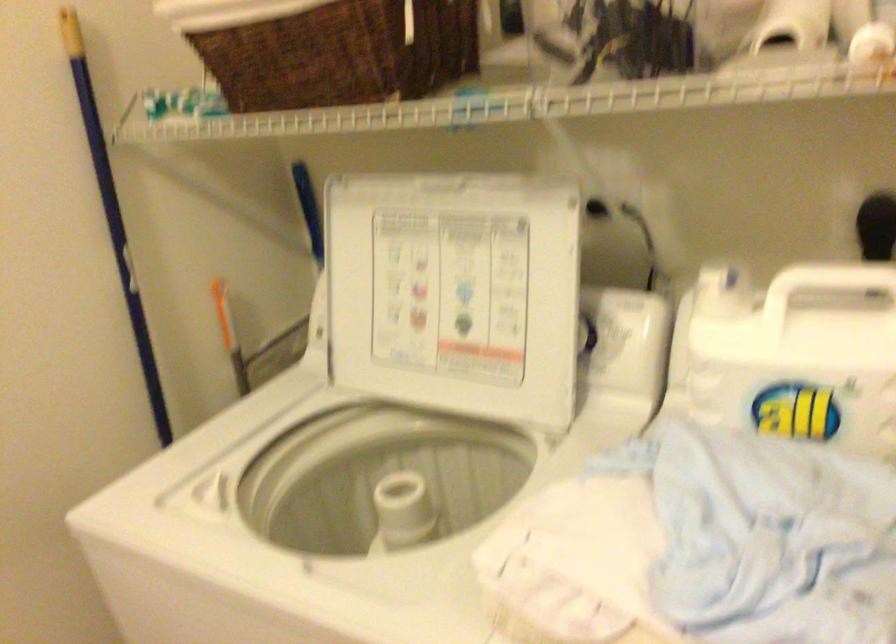
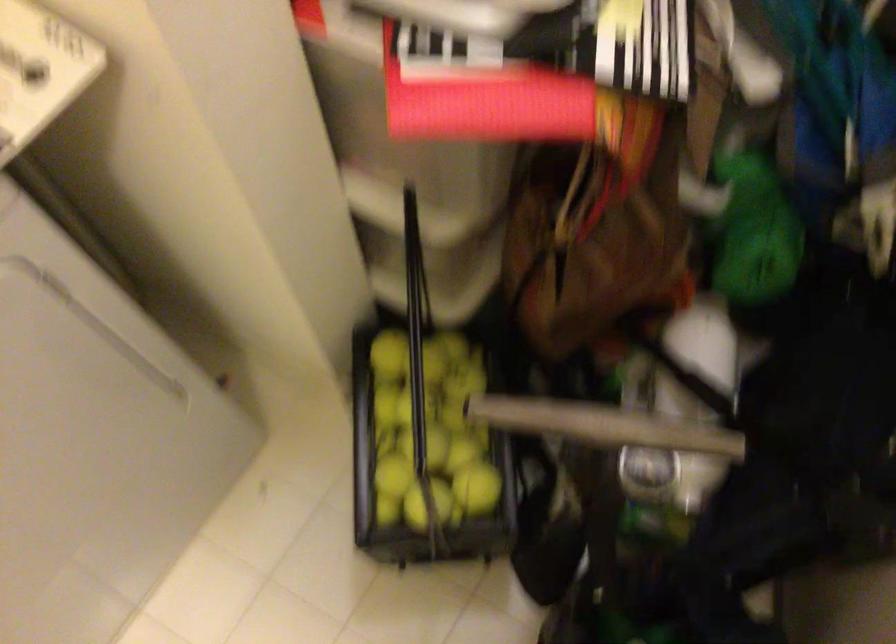
First-person continuous shooting, in which direction is the camera rotating?

The camera rotated toward right-down.